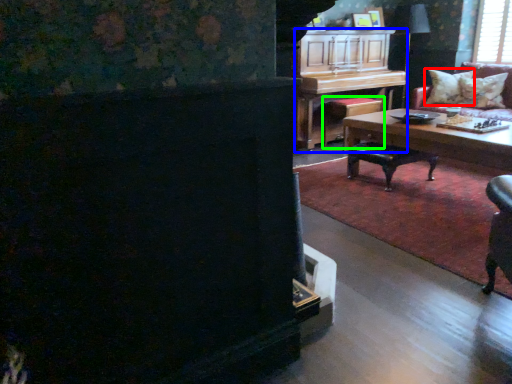
Question: Estimate the real-world distances between objects in this image. Which object is closer to pillow (highlighted by a red box), piano (highlighted by a blue box) or stool (highlighted by a green box)?

Choices:
 (A) piano
 (B) stool

Answer: (B)